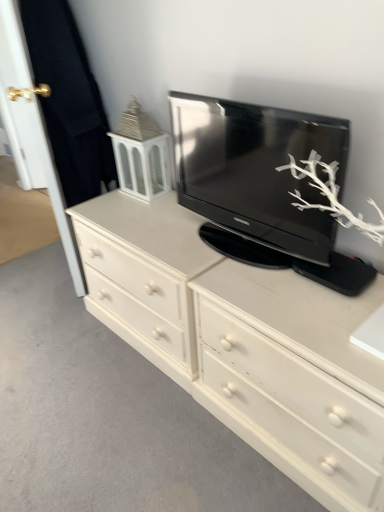
Locate an element on the screen. This screenshot has width=384, height=512. free spot above white matte drawer at center (from a real-world perspective) is located at coordinates (314, 307).